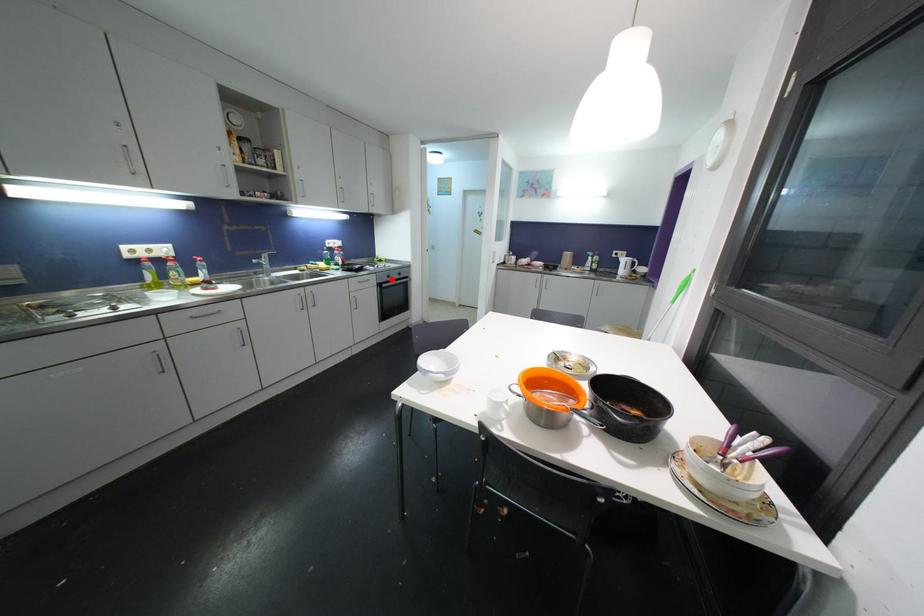
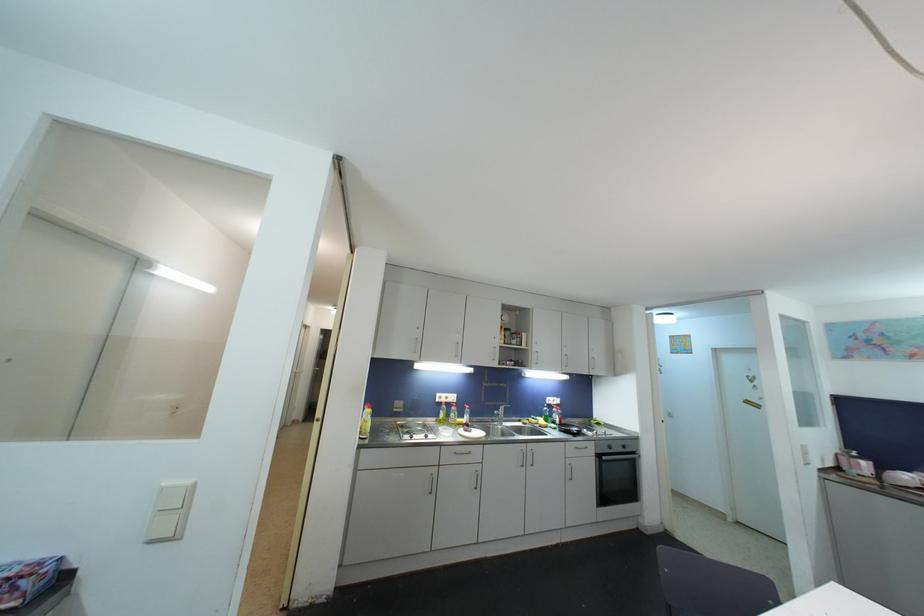
Question: A red point is marked in image1. In image2, is the corresponding 3D point closer to the camera or farther? Reply with the corresponding letter.

Choices:
 (A) The corresponding 3D point is closer.
 (B) The corresponding 3D point is farther.

Answer: (B)